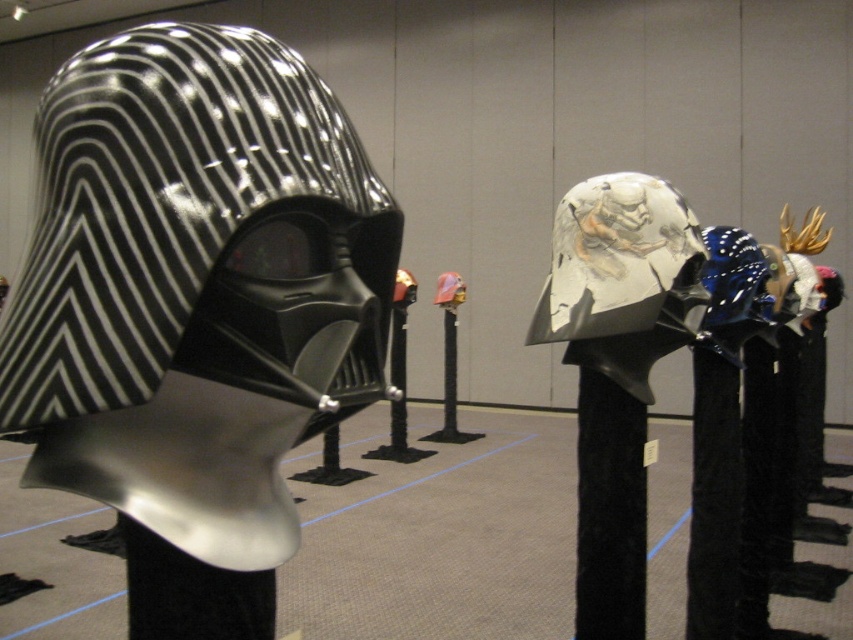
Who is higher up, black glossy helmet at left or black velvet post at center?

Positioned higher is black glossy helmet at left.

Does point (207, 161) come behind point (729, 520)?

No, it is in front of (729, 520).

This screenshot has width=853, height=640. Find the location of `black glossy helmet at left`. black glossy helmet at left is located at coordinates point(196,244).

Between black velvet pillar at center and black velvet post at center, which one has less height?

Standing shorter between the two is black velvet pillar at center.

Which is behind, point (618, 444) or point (717, 355)?

The point (717, 355) is behind.

At what (x,y) coordinates should I click in order to perform the action: click on black velvet pillar at center. Please return your answer as a coordinate pair (x, y). Looking at the image, I should click on (608, 509).

Is black glossy helmet at left bigger than black velvet pillar at center?

Indeed, black glossy helmet at left has a larger size compared to black velvet pillar at center.

Who is more forward, (x=363, y=294) or (x=645, y=499)?

Point (x=363, y=294) is in front.

You are a GUI agent. You are given a task and a screenshot of the screen. Output one action in this format:
    pyautogui.click(x=<x>, y=<y>)
    Task: Click on the black glossy helmet at left
    The height and width of the screenshot is (640, 853).
    Given the screenshot: What is the action you would take?
    pyautogui.click(x=196, y=244)

The height and width of the screenshot is (640, 853). What are the coordinates of `black glossy helmet at left` in the screenshot? It's located at (196, 244).